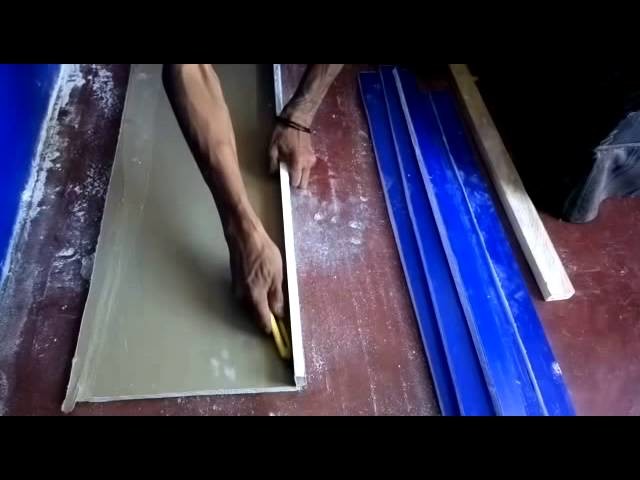
Where is `wall`? The width and height of the screenshot is (640, 480). wall is located at coordinates (17, 99).